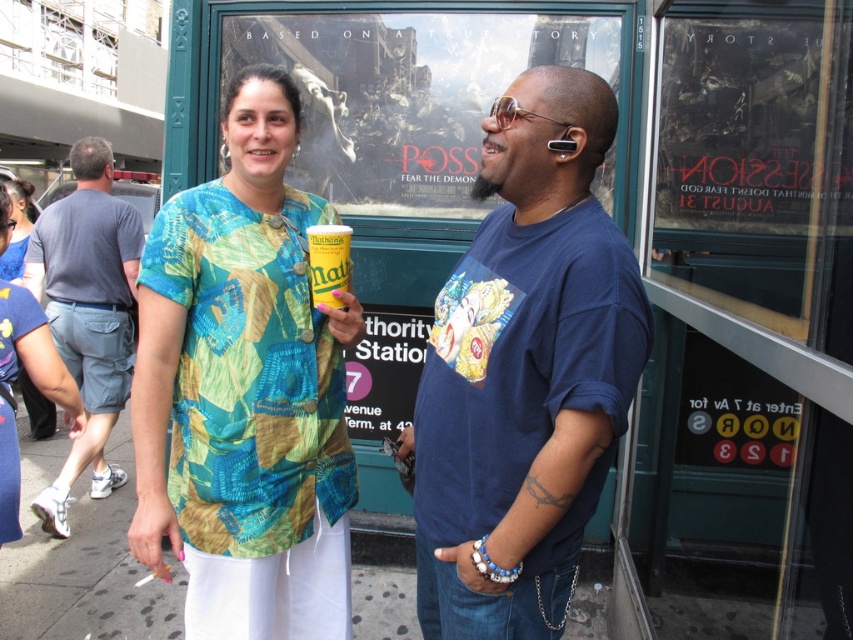
From the picture: You are standing in front of the storefront window and want to place a new sticker. You have two points marked on the window where you can place it. The points are labeled as point (x=474, y=268) and point (x=77, y=260). Which point is closer to you?

Point (x=474, y=268) is closer to the viewer than point (x=77, y=260).

You are a photographer trying to capture a clear shot of both the printed fabric shirt at center and the yellow matte can at center. Since you want to ensure both are in focus, you need to know which object is taller. Can you tell me which one is taller?

The printed fabric shirt at center is taller than the yellow matte can at center according to the description.